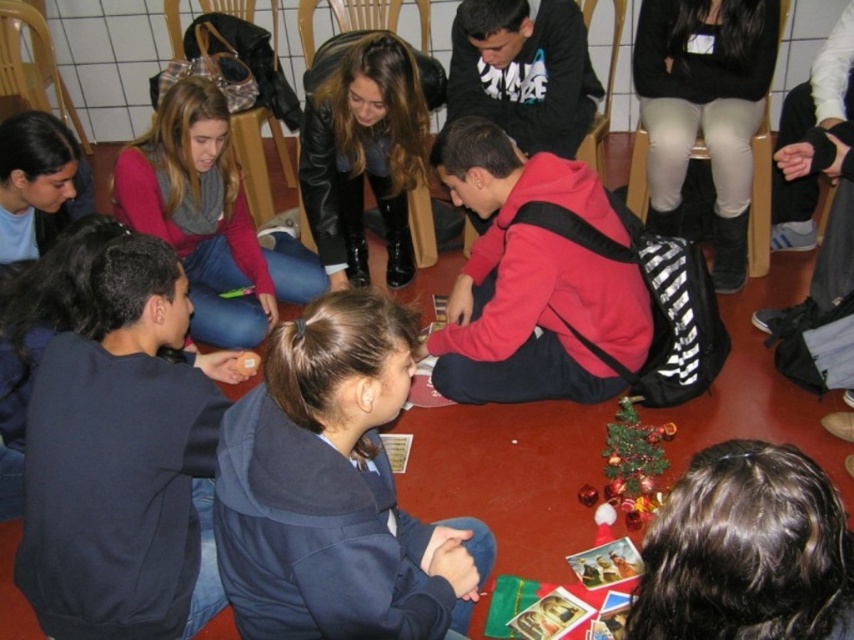
You are a photographer trying to capture a clear shot of the dark blue hoodie at center without the matte red sweater at center blocking it. Based on the scene description, can you position yourself in a way to achieve this?

The dark blue hoodie at center is in front of the matte red sweater at center, so positioning yourself behind the dark blue hoodie at center would allow you to capture it without the matte red sweater at center blocking the view.

You are standing in the room and want to reach both the point at (303, 339) and the point at (758, 620). Which point will you reach first if you move straight towards them?

You will reach point (303, 339) first because it is closer to you than point (758, 620), which is further away.